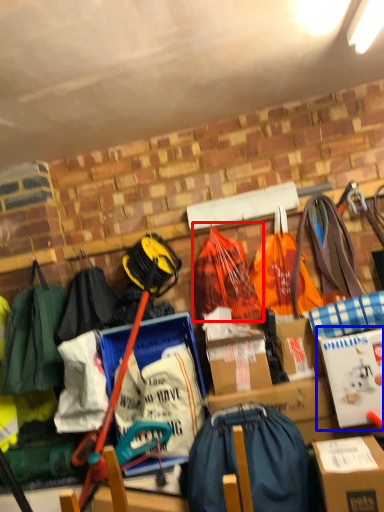
Question: Which object appears farthest to the camera in this image, grocery bag (highlighted by a red box) or cardboard box (highlighted by a blue box)?

Choices:
 (A) grocery bag
 (B) cardboard box

Answer: (A)